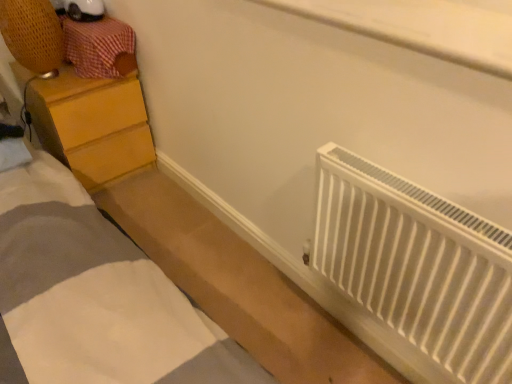
Find the location of a particular element. The height and width of the screenshot is (384, 512). free space above white plastic radiator at lower right (from a real-world perspective) is located at coordinates (426, 198).